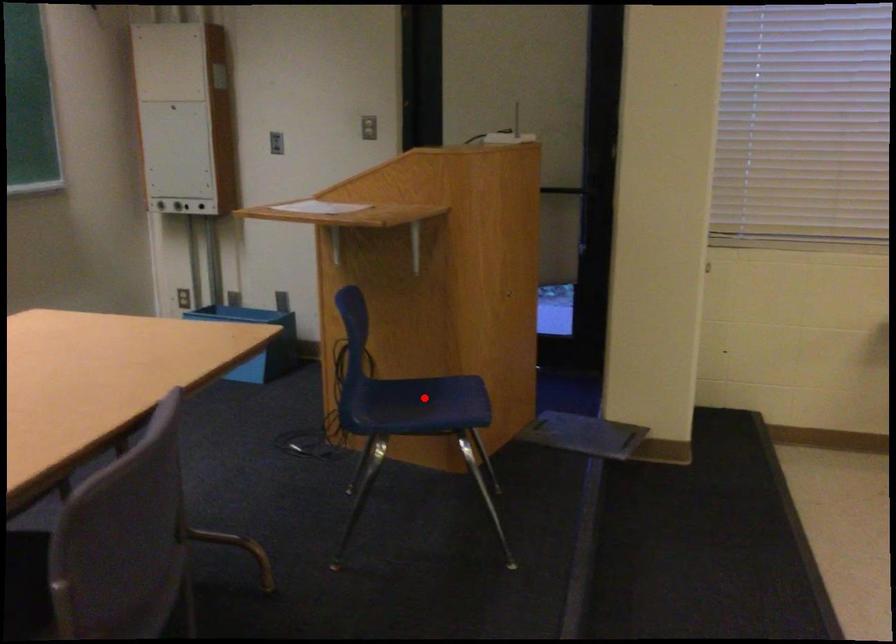
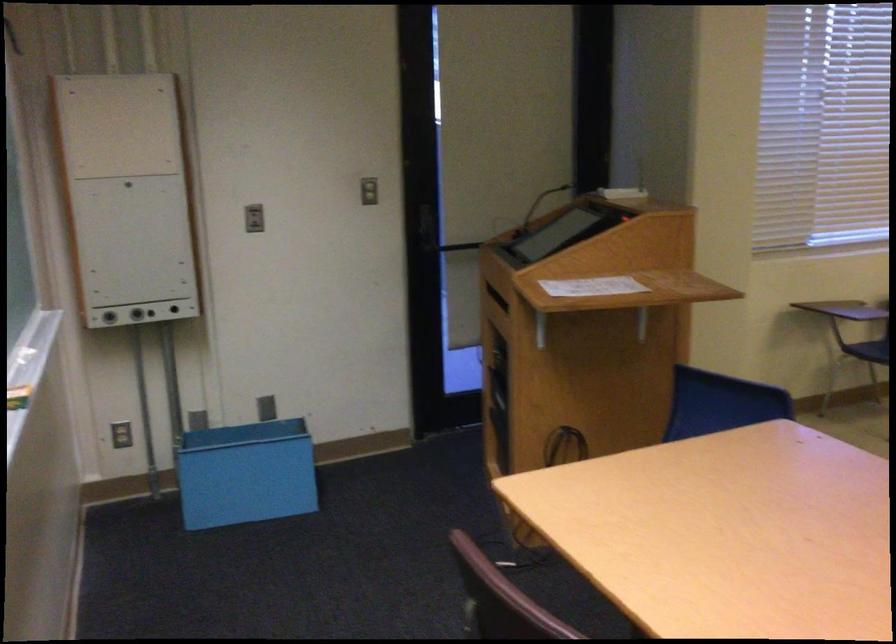
Question: I am providing you with two images of the same scene from different viewpoints. A red point is marked on the first image. At the location where the point appears in image 1, is it still visible in image 2?

Choices:
 (A) Yes
 (B) No

Answer: (B)